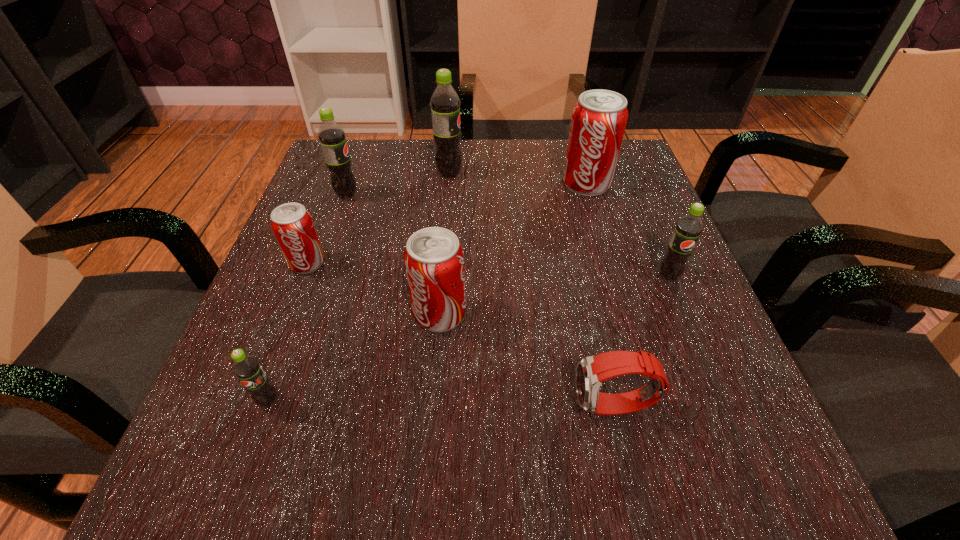
Where is `vacant space in between the second nearest soda and the rightmost green soda`? This screenshot has height=540, width=960. vacant space in between the second nearest soda and the rightmost green soda is located at coordinates (554, 294).

The width and height of the screenshot is (960, 540). Identify the location of vacant area that lies between the watch and the second green soda from right to left. (532, 291).

Locate an element on the screen. The image size is (960, 540). vacant area between the rightmost green soda and the farthest green soda is located at coordinates (559, 225).

Where is `object that is the sixth closest one to the third smallest green soda`? object that is the sixth closest one to the third smallest green soda is located at coordinates (591, 371).

The width and height of the screenshot is (960, 540). Find the location of `the fourth closest object to the second farthest red soda can`. the fourth closest object to the second farthest red soda can is located at coordinates (445, 103).

Select which soda is the sixth closest to the tallest object. Please provide its 2D coordinates. Your answer should be formatted as a tuple, i.e. [(x, y)], where the tuple contains the x and y coordinates of a point satisfying the conditions above.

[(247, 368)]

Where is `the second closest soda to the second soda from right to left`? The image size is (960, 540). the second closest soda to the second soda from right to left is located at coordinates (445, 103).

The height and width of the screenshot is (540, 960). Identify the location of the third closest green soda to the smallest green soda. (688, 228).

Point out which green soda is positioned as the second nearest to the smallest green soda. Please provide its 2D coordinates. Your answer should be formatted as a tuple, i.e. [(x, y)], where the tuple contains the x and y coordinates of a point satisfying the conditions above.

[(445, 103)]

Identify the location of red soda can that stands as the closest to the nearest green soda. This screenshot has height=540, width=960. (434, 259).